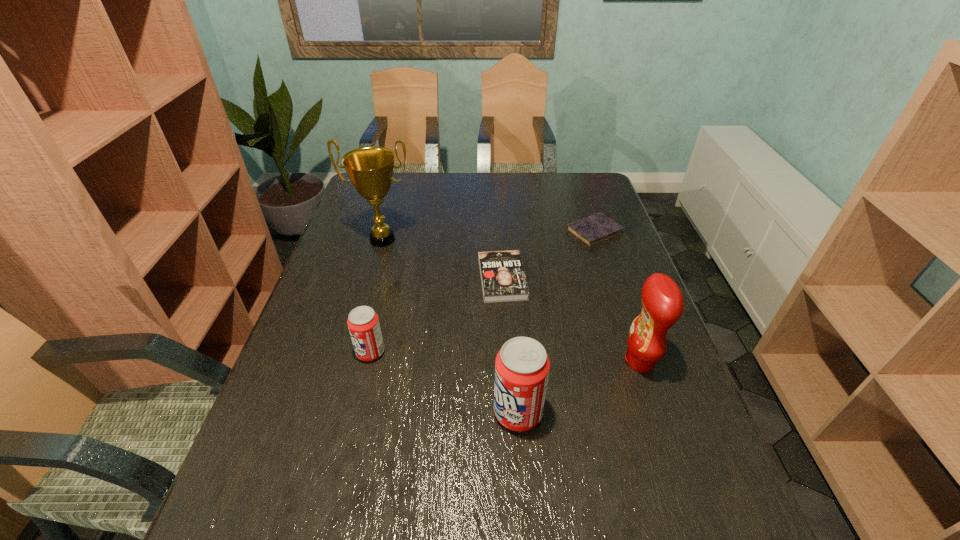
In the current image, all soda cans are evenly spaced. To maintain this equal spacing, where should an additional soda can be placed on the right? Please point out a free spot. Please provide its 2D coordinates. Your answer should be formatted as a tuple, i.e. [(x, y)], where the tuple contains the x and y coordinates of a point satisfying the conditions above.

[(709, 491)]